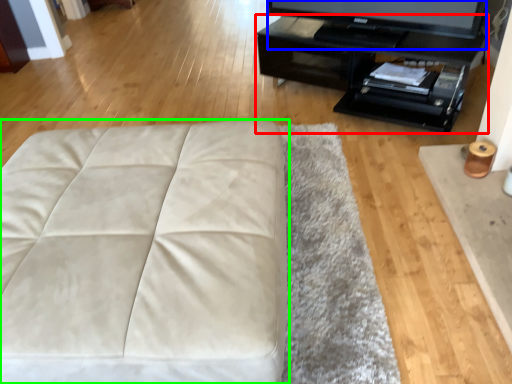
Question: Which object is the closest to the table (highlighted by a red box)? Choose among these: television (highlighted by a blue box) or furniture (highlighted by a green box).

Choices:
 (A) television
 (B) furniture

Answer: (A)